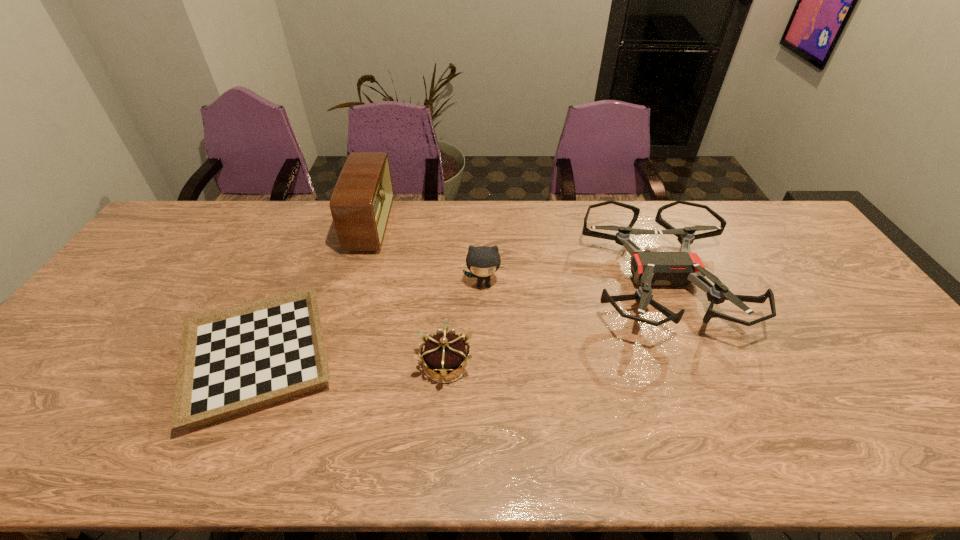
Where is `unoccupied position between the checkerboard and the second tallest object`? unoccupied position between the checkerboard and the second tallest object is located at coordinates (371, 321).

Identify the location of vacant space that is in between the radio receiver and the kitten. (427, 255).

Identify the location of free space that is in between the rightmost object and the checkerboard. The image size is (960, 540). (459, 319).

Image resolution: width=960 pixels, height=540 pixels. In order to click on free space between the kitten and the rightmost object in this screenshot , I will do `click(571, 282)`.

This screenshot has height=540, width=960. Identify the location of empty space that is in between the shortest object and the fourth shortest object. (371, 321).

At what (x,y) coordinates should I click in order to perform the action: click on free point between the radio receiver and the drone. Please return your answer as a coordinate pair (x, y). This screenshot has height=540, width=960. Looking at the image, I should click on (516, 254).

Identify the location of vacant area that lies between the shortest object and the crown. (352, 361).

The height and width of the screenshot is (540, 960). What are the coordinates of `free space between the rightmost object and the crown` in the screenshot? It's located at (553, 322).

Locate an element on the screen. This screenshot has width=960, height=540. vacant region between the crown and the drone is located at coordinates (553, 322).

Identify which object is the second nearest to the crown. Please provide its 2D coordinates. Your answer should be formatted as a tuple, i.e. [(x, y)], where the tuple contains the x and y coordinates of a point satisfying the conditions above.

[(234, 360)]